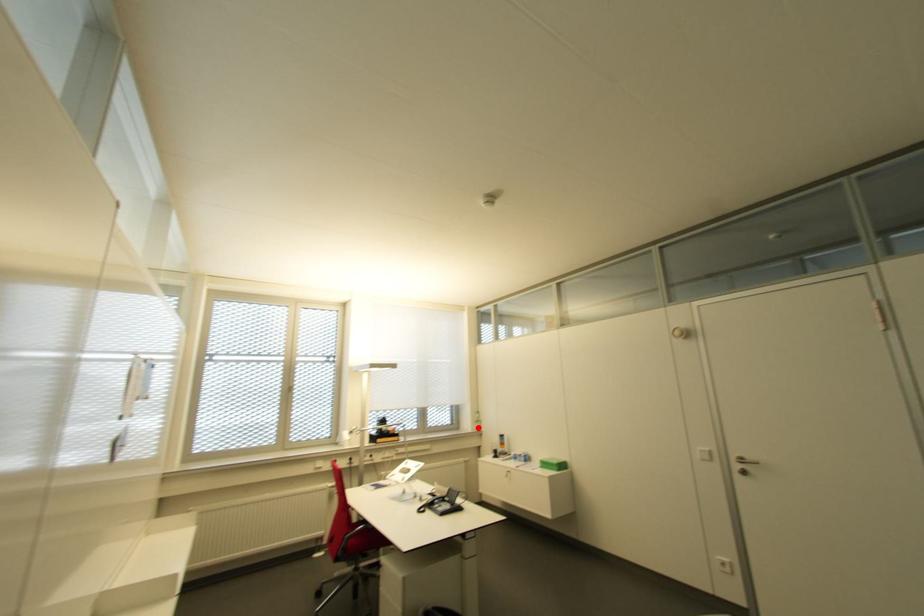
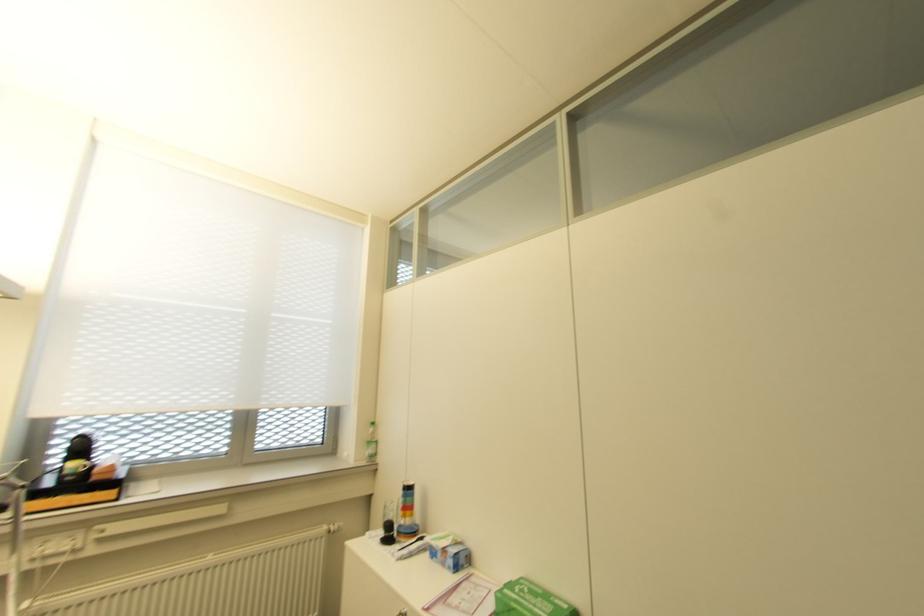
Locate, in the second image, the point that corresponds to the highlighted location in the first image.

(372, 455)